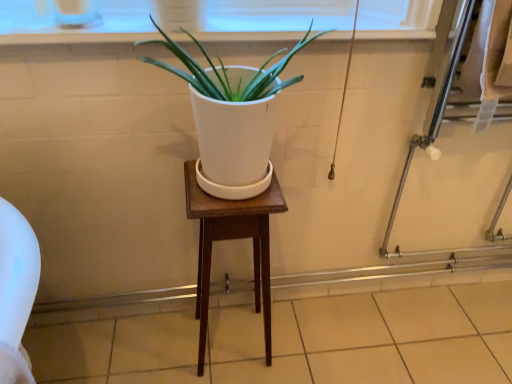
Question: Do you think white plastic window frame at upper center is within wooden stool at center, or outside of it?

Choices:
 (A) inside
 (B) outside

Answer: (B)

Question: Considering the positions of white plastic window frame at upper center and wooden stool at center in the image, is white plastic window frame at upper center bigger or smaller than wooden stool at center?

Choices:
 (A) big
 (B) small

Answer: (B)

Question: Considering the real-world distances, which object is closest to the wooden stool at center?

Choices:
 (A) beige tile at lower center
 (B) clear glass screen door at right
 (C) white matte pot at center
 (D) white plastic window frame at upper center

Answer: (C)

Question: Which object is the closest to the beige tile at lower center?

Choices:
 (A) clear glass screen door at right
 (B) wooden stool at center
 (C) white matte pot at center
 (D) white plastic window frame at upper center

Answer: (B)